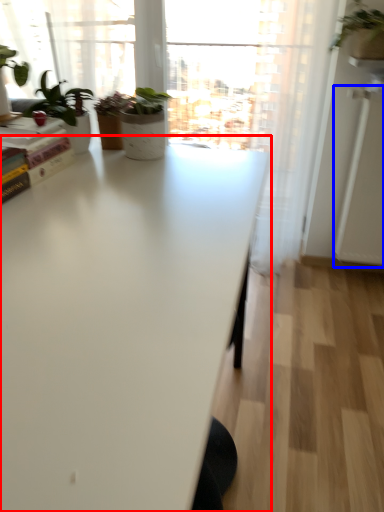
Question: Among these objects, which one is farthest to the camera, table (highlighted by a red box) or screen door (highlighted by a blue box)?

Choices:
 (A) table
 (B) screen door

Answer: (B)